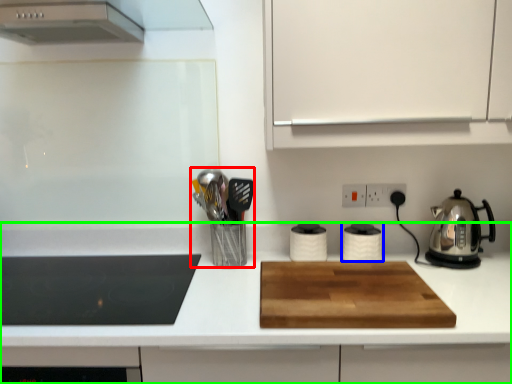
Question: Considering the real-world distances, which object is closest to appliance (highlighted by a red box)? kitchen appliance (highlighted by a blue box) or countertop (highlighted by a green box).

Choices:
 (A) kitchen appliance
 (B) countertop

Answer: (B)